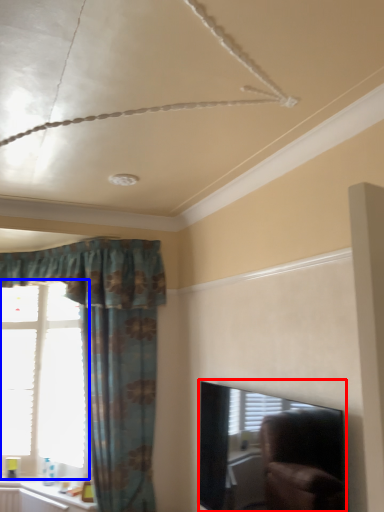
Question: Which point is further to the camera, window screen (highlighted by a red box) or window (highlighted by a blue box)?

Choices:
 (A) window screen
 (B) window

Answer: (B)